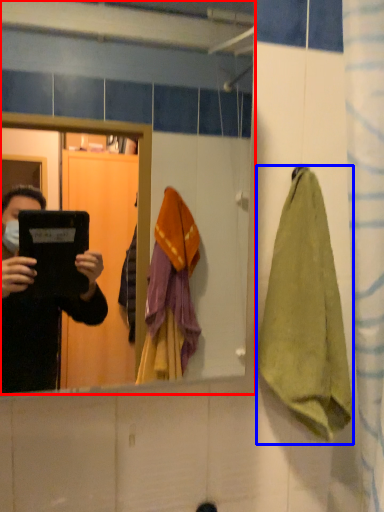
Question: Among these objects, which one is farthest to the camera, mirror (highlighted by a red box) or towel/napkin (highlighted by a blue box)?

Choices:
 (A) mirror
 (B) towel/napkin

Answer: (B)